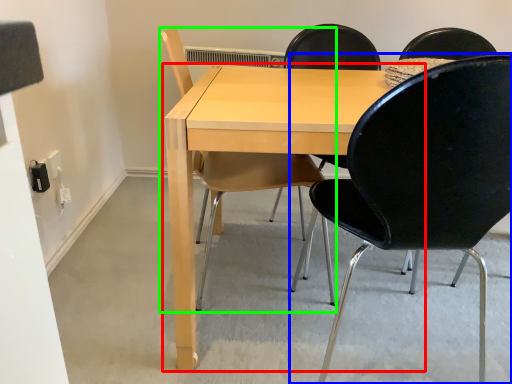
Question: Which object is positioned farthest from table (highlighted by a red box)? Select from chair (highlighted by a blue box) and chair (highlighted by a green box).

Choices:
 (A) chair
 (B) chair

Answer: (A)